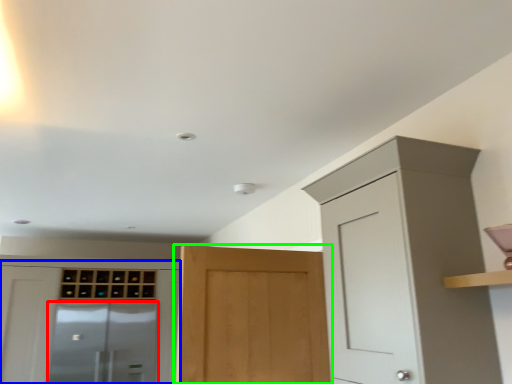
Question: Which object is the closest to the screen door (highlighted by a red box)? Choose among these: cabinetry (highlighted by a blue box) or door (highlighted by a green box).

Choices:
 (A) cabinetry
 (B) door

Answer: (A)